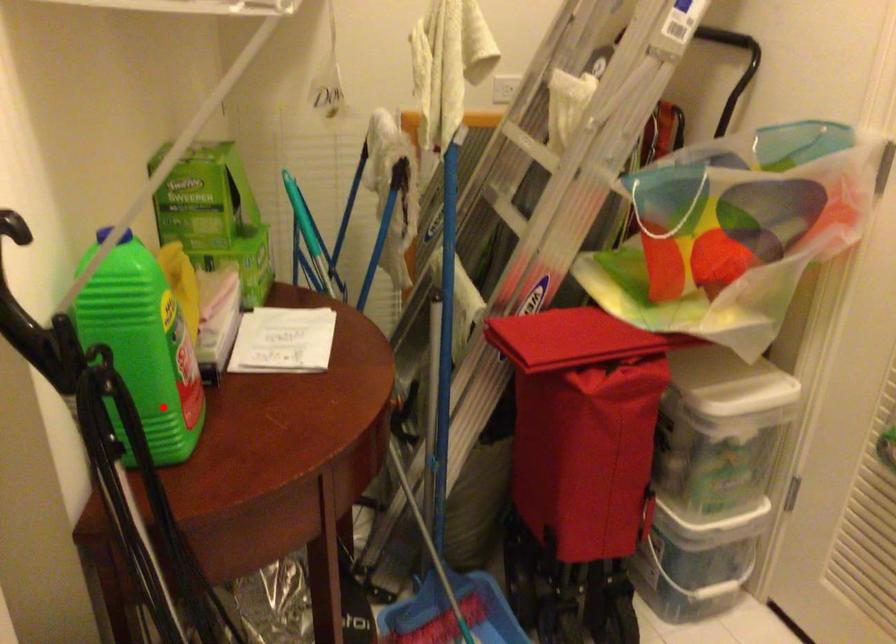
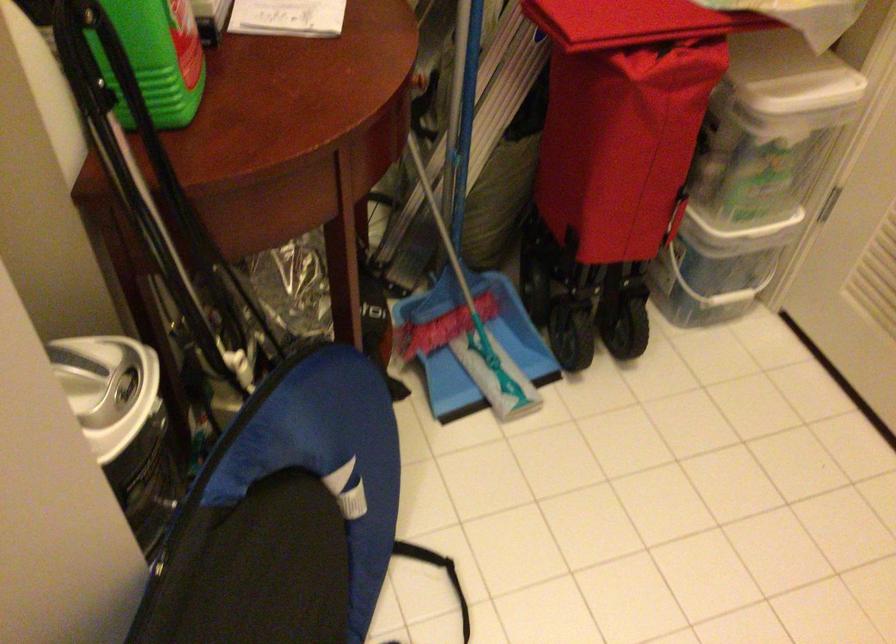
Question: I am providing you with two images of the same scene from different viewpoints. A red point is shown in image1. For the corresponding object point in image2, is it positioned nearer or farther from the camera?

Choices:
 (A) Nearer
 (B) Farther

Answer: (A)